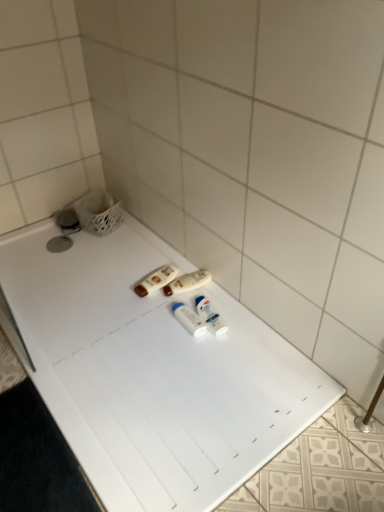
Identify the location of free space to the back side of white plastic deodorant at center, acting as the first toiletry starting from the right. (206, 297).